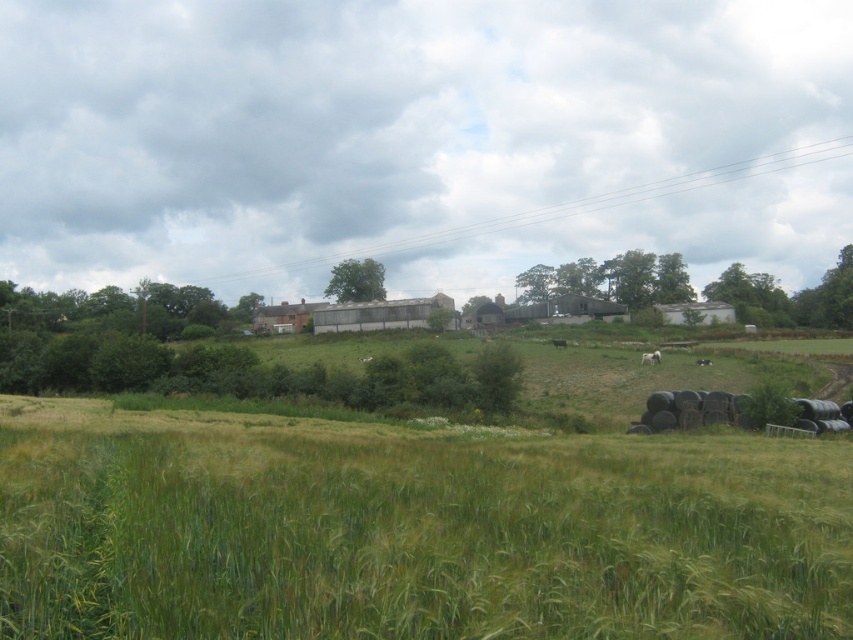
Question: In this image, where is green grassy wheat field at lower center located relative to white woolly sheep at center?

Choices:
 (A) above
 (B) below

Answer: (B)

Question: Can you confirm if white woolly sheep at center is positioned below white fluffy sheep at lower right?

Choices:
 (A) yes
 (B) no

Answer: (B)

Question: Does white woolly sheep at center appear on the right side of white fluffy sheep at lower right?

Choices:
 (A) no
 (B) yes

Answer: (A)

Question: Which is nearer to the white fluffy sheep at lower right?

Choices:
 (A) green grassy wheat field at lower center
 (B) white woolly sheep at center

Answer: (B)

Question: Among these points, which one is farthest from the camera?

Choices:
 (A) (648, 358)
 (B) (235, 438)

Answer: (A)

Question: Among these objects, which one is farthest from the camera?

Choices:
 (A) white fluffy sheep at lower right
 (B) green grassy wheat field at lower center

Answer: (A)